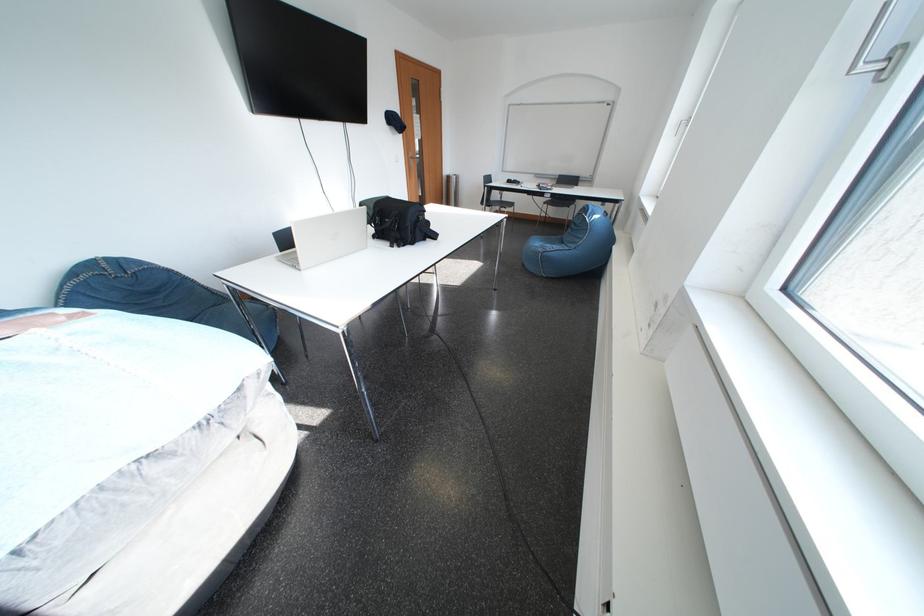
Find where to pull the door handle. Please return your answer as a coordinate pair (x, y).

(415, 156)